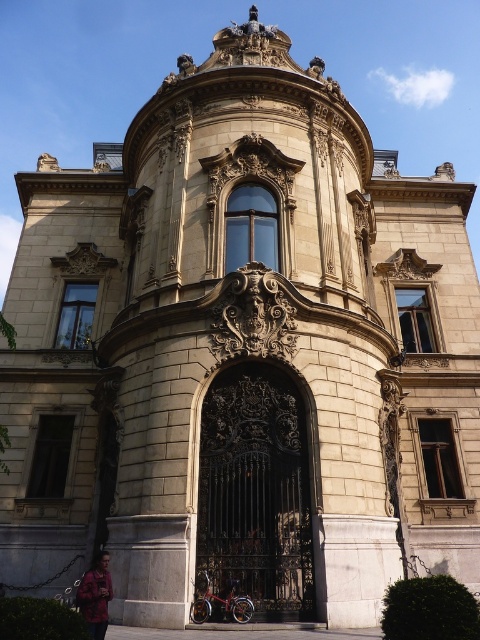
Does black wrought iron gate at center have a larger size compared to red cotton jacket at lower left?

No.

Image resolution: width=480 pixels, height=640 pixels. What do you see at coordinates (255, 492) in the screenshot? I see `black wrought iron gate at center` at bounding box center [255, 492].

Which is behind, point (243, 401) or point (83, 598)?

The point (243, 401) is more distant.

You are a GUI agent. You are given a task and a screenshot of the screen. Output one action in this format:
    pyautogui.click(x=<x>, y=<y>)
    Task: Click on the black wrought iron gate at center
    This screenshot has height=640, width=480.
    Given the screenshot: What is the action you would take?
    pyautogui.click(x=255, y=492)